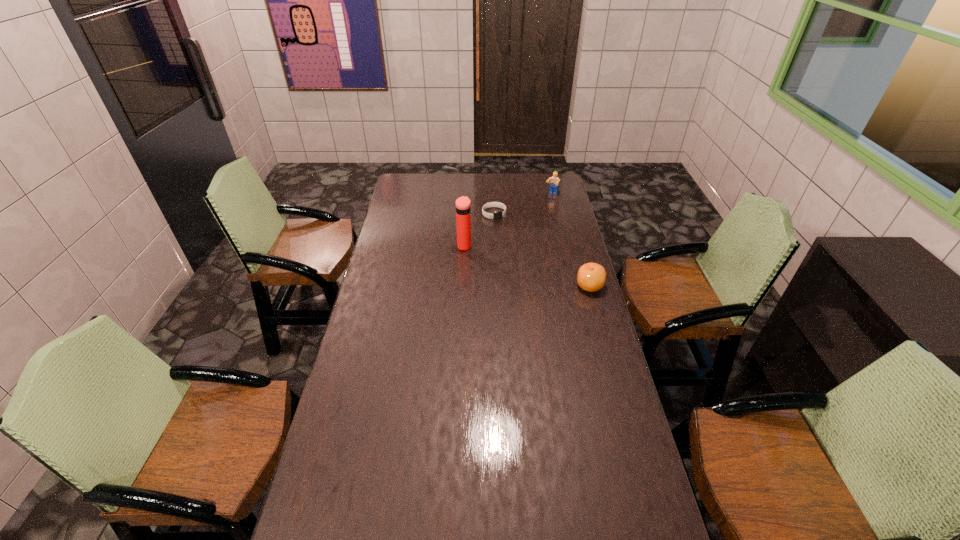
What are the coordinates of `vacant space on the desktop that is between the tallest object and the clementine and is positioned on the outer surface of the wristband` in the screenshot? It's located at (532, 267).

You are a GUI agent. You are given a task and a screenshot of the screen. Output one action in this format:
    pyautogui.click(x=<x>, y=<y>)
    Task: Click on the vacant space on the desktop that is between the tallest object and the clementine and is positioned on the face of the farthest object
    
    Given the screenshot: What is the action you would take?
    pyautogui.click(x=508, y=260)